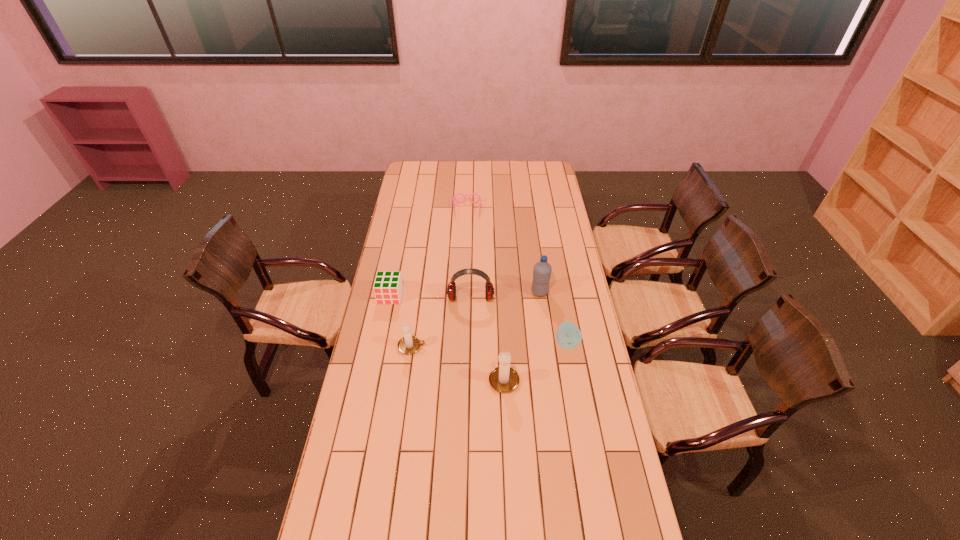
Where is `empty space that is in between the earphone and the cube`? empty space that is in between the earphone and the cube is located at coordinates (430, 297).

Identify the location of free spot between the apple and the right candle holder. (536, 361).

Find the location of a particular element. Image resolution: width=960 pixels, height=540 pixels. free space between the apple and the tallest object is located at coordinates (553, 318).

Find the location of a particular element. This screenshot has height=540, width=960. free space that is in between the cube and the earphone is located at coordinates (430, 297).

Locate an element on the screen. vacant space in between the earphone and the tallest object is located at coordinates click(505, 295).

Find the location of `free area in between the earphone and the nearer candle holder`. free area in between the earphone and the nearer candle holder is located at coordinates (488, 338).

Locate an element on the screen. This screenshot has width=960, height=540. free space that is in between the apple and the leftmost object is located at coordinates (478, 320).

You are a GUI agent. You are given a task and a screenshot of the screen. Output one action in this format:
    pyautogui.click(x=<x>, y=<y>)
    Task: Click on the object that ranks as the closest to the earphone
    The width and height of the screenshot is (960, 540).
    Given the screenshot: What is the action you would take?
    pyautogui.click(x=542, y=270)

Locate an element on the screen. object that stands as the fifth closest to the left candle holder is located at coordinates (568, 336).

Image resolution: width=960 pixels, height=540 pixels. What are the coordinates of `free location that satisfies the following two spatial constraints: 1. on the handle side of the farther candle holder; 2. on the handle side of the taller candle holder` in the screenshot? It's located at (407, 379).